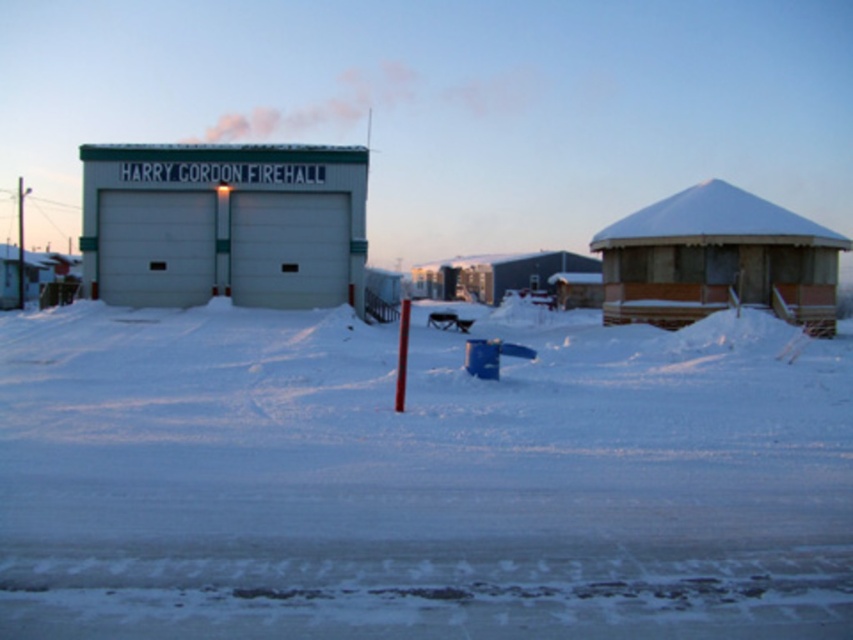
Which of these two, white matte firehall at center or wooden cabin at right, stands taller?

white matte firehall at center is taller.

Is point (347, 244) positioned before point (709, 268)?

That is False.

Find the location of a particular element. The image size is (853, 640). white matte firehall at center is located at coordinates [x=223, y=224].

Where is `white powdery snow at center`? white powdery snow at center is located at coordinates (419, 477).

Can you confirm if white powdery snow at center is positioned to the right of white matte firehall at center?

Indeed, white powdery snow at center is positioned on the right side of white matte firehall at center.

In the scene shown: Who is more distant from viewer, (722, 388) or (265, 228)?

Positioned behind is point (265, 228).

Locate an element on the screen. This screenshot has width=853, height=640. white powdery snow at center is located at coordinates (419, 477).

Is white powdery snow at center above wooden cabin at right?

No, white powdery snow at center is not above wooden cabin at right.

Which is more to the left, white powdery snow at center or wooden cabin at right?

From the viewer's perspective, white powdery snow at center appears more on the left side.

Based on the photo, who is more forward, [106,364] or [643,227]?

Point [106,364]

I want to click on white powdery snow at center, so [419, 477].